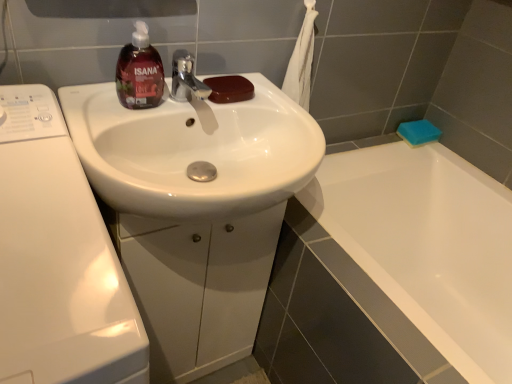
This screenshot has height=384, width=512. What do you see at coordinates (198, 287) in the screenshot? I see `white glossy cabinet at center` at bounding box center [198, 287].

What do you see at coordinates (418, 132) in the screenshot? The width and height of the screenshot is (512, 384). I see `blue sponge at upper right, which is the first soap from right to left` at bounding box center [418, 132].

In order to face brown glossy soap at center, which is the 2th soap in right-to-left order, should I rotate leftwards or rightwards?

It's best to rotate left around 3.288 degrees.

The height and width of the screenshot is (384, 512). Describe the element at coordinates (139, 72) in the screenshot. I see `translucent dark red liquid soap at upper left` at that location.

The image size is (512, 384). In order to click on white glossy washing machine at left in this screenshot , I will do `click(58, 259)`.

What are the coordinates of `white glossy cabinet at center` in the screenshot? It's located at (198, 287).

Is point (274, 243) positioned in front of point (233, 87)?

No, (274, 243) is further to viewer.

Is white glossy cabinet at center oriented towards brown glossy soap at center, the second soap from the back?

No, white glossy cabinet at center is not aimed at brown glossy soap at center, the second soap from the back.

Is white glossy cabinet at center thinner than brown glossy soap at center, placed as the first soap when sorted from left to right?

No.

Which soap is the 1st one when counting from the right side of the white glossy cabinet at center? Please provide its 2D coordinates.

[(229, 89)]

Looking at this image, can you confirm if brown glossy soap at center, placed as the first soap when sorted from left to right, is positioned to the right of blue sponge at upper right, the 2th soap viewed from the left?

Incorrect, brown glossy soap at center, placed as the first soap when sorted from left to right, is not on the right side of blue sponge at upper right, the 2th soap viewed from the left.

Does brown glossy soap at center, which is the 1th soap in front-to-back order, touch blue sponge at upper right, the 2th soap viewed from the left?

No, brown glossy soap at center, which is the 1th soap in front-to-back order, is not next to blue sponge at upper right, the 2th soap viewed from the left.

Does brown glossy soap at center, the second soap from the back, turn towards blue sponge at upper right, acting as the second soap starting from the front?

No, brown glossy soap at center, the second soap from the back, does not turn towards blue sponge at upper right, acting as the second soap starting from the front.

Is brown glossy soap at center, which is the 2th soap in right-to-left order, thinner than blue sponge at upper right, which is the first soap from right to left?

Yes.

Which of these two, translucent dark red liquid soap at upper left or white glossy washing machine at left, is thinner?

translucent dark red liquid soap at upper left is thinner.

Are translucent dark red liquid soap at upper left and white glossy washing machine at left located far from each other?

Actually, translucent dark red liquid soap at upper left and white glossy washing machine at left are a little close together.

Who is taller, translucent dark red liquid soap at upper left or white glossy washing machine at left?

white glossy washing machine at left is taller.

Is translucent dark red liquid soap at upper left behind white glossy washing machine at left?

Yes, it is behind white glossy washing machine at left.

How far apart are blue sponge at upper right, acting as the second soap starting from the front, and brown glossy soap at center, the second soap from the back?

blue sponge at upper right, acting as the second soap starting from the front, and brown glossy soap at center, the second soap from the back, are 30.25 inches apart from each other.

From a real-world perspective, relative to brown glossy soap at center, placed as the first soap when sorted from left to right, is blue sponge at upper right, which is the first soap from right to left, vertically above or below?

In terms of real-world spatial position, blue sponge at upper right, which is the first soap from right to left, is below brown glossy soap at center, placed as the first soap when sorted from left to right.

Considering the sizes of objects blue sponge at upper right, acting as the second soap starting from the front, and brown glossy soap at center, which is the 2th soap in right-to-left order, in the image provided, who is smaller, blue sponge at upper right, acting as the second soap starting from the front, or brown glossy soap at center, which is the 2th soap in right-to-left order,?

brown glossy soap at center, which is the 2th soap in right-to-left order.

Which object is thinner, blue sponge at upper right, acting as the second soap starting from the front, or brown glossy soap at center, placed as the first soap when sorted from left to right?

With smaller width is brown glossy soap at center, placed as the first soap when sorted from left to right.

In terms of height, does brown glossy soap at center, placed as the first soap when sorted from left to right, look taller or shorter compared to white glossy sink at center?

In the image, brown glossy soap at center, placed as the first soap when sorted from left to right, appears to be shorter than white glossy sink at center.

From a real-world perspective, is brown glossy soap at center, which is the 2th soap in right-to-left order, physically below white glossy sink at center?

Actually, brown glossy soap at center, which is the 2th soap in right-to-left order, is physically above white glossy sink at center in the real world.

Does brown glossy soap at center, placed as the first soap when sorted from left to right, touch white glossy sink at center?

They are not placed beside each other.

Considering the relative positions of brown glossy soap at center, placed as the first soap when sorted from left to right, and white glossy sink at center in the image provided, is brown glossy soap at center, placed as the first soap when sorted from left to right, to the left or to the right of white glossy sink at center?

Based on their positions, brown glossy soap at center, placed as the first soap when sorted from left to right, is located to the right of white glossy sink at center.

Do you think brown glossy soap at center, the second soap from the back, is within white glossy washing machine at left, or outside of it?

brown glossy soap at center, the second soap from the back, is not enclosed by white glossy washing machine at left.

Between brown glossy soap at center, which is the 2th soap in right-to-left order, and white glossy washing machine at left, which one has smaller width?

brown glossy soap at center, which is the 2th soap in right-to-left order, is thinner.

Can you tell me how much brown glossy soap at center, which is the 1th soap in front-to-back order, and white glossy washing machine at left differ in facing direction?

The angular difference between brown glossy soap at center, which is the 1th soap in front-to-back order, and white glossy washing machine at left is 1.34 degrees.

Is the depth of white glossy sink at center greater than that of translucent dark red liquid soap at upper left?

No, white glossy sink at center is in front of translucent dark red liquid soap at upper left.

Does point (65, 114) come farther from viewer compared to point (151, 51)?

No, it is not.

Who is bigger, white glossy sink at center or translucent dark red liquid soap at upper left?

white glossy sink at center.

Find the location of a particular element. This screenshot has width=512, height=384. the 1st soap behind the white glossy cabinet at center is located at coordinates (229, 89).

Identify the location of soap to the right of brown glossy soap at center, which is the 1th soap in front-to-back order. The image size is (512, 384). (418, 132).

Based on the photo, from the image, which object appears to be nearer to translucent dark red liquid soap at upper left, white glossy sink at center or white glossy cabinet at center?

white glossy sink at center.

Estimate the real-world distances between objects in this image. Which object is closer to translucent dark red liquid soap at upper left, blue sponge at upper right, acting as the second soap starting from the front, or white glossy washing machine at left?

The object closer to translucent dark red liquid soap at upper left is white glossy washing machine at left.

Looking at this image, considering their positions, is blue sponge at upper right, acting as the second soap starting from the front, positioned closer to white glossy washing machine at left than translucent dark red liquid soap at upper left?

translucent dark red liquid soap at upper left is positioned closer to the anchor white glossy washing machine at left.

Which object lies nearer to the anchor point translucent dark red liquid soap at upper left, white glossy cabinet at center or white glossy washing machine at left?

white glossy washing machine at left lies closer to translucent dark red liquid soap at upper left than the other object.

Based on their spatial positions, is brown glossy soap at center, placed as the first soap when sorted from left to right, or white glossy sink at center closer to white glossy cabinet at center?

white glossy sink at center lies closer to white glossy cabinet at center than the other object.

When comparing their distances from white glossy cabinet at center, does translucent dark red liquid soap at upper left or white glossy sink at center seem further?

translucent dark red liquid soap at upper left lies further to white glossy cabinet at center than the other object.

Looking at the image, which one is located further to blue sponge at upper right, acting as the second soap starting from the front, white glossy washing machine at left or translucent dark red liquid soap at upper left?

Among the two, white glossy washing machine at left is located further to blue sponge at upper right, acting as the second soap starting from the front.

Looking at the image, which one is located further to blue sponge at upper right, which is the first soap from right to left, white glossy sink at center or translucent dark red liquid soap at upper left?

translucent dark red liquid soap at upper left.

This screenshot has height=384, width=512. What are the coordinates of `soap between white glossy cabinet at center and blue sponge at upper right, acting as the second soap starting from the front` in the screenshot? It's located at (229, 89).

Image resolution: width=512 pixels, height=384 pixels. Find the location of `sink between translucent dark red liquid soap at upper left and white glossy washing machine at left from top to bottom`. sink between translucent dark red liquid soap at upper left and white glossy washing machine at left from top to bottom is located at coordinates (193, 151).

This screenshot has height=384, width=512. I want to click on mouthwash positioned between white glossy washing machine at left and blue sponge at upper right, acting as the second soap starting from the front, from near to far, so click(x=139, y=72).

Image resolution: width=512 pixels, height=384 pixels. Find the location of `drawer located between translucent dark red liquid soap at upper left and blue sponge at upper right, the 2th soap viewed from the left, in the left-right direction`. drawer located between translucent dark red liquid soap at upper left and blue sponge at upper right, the 2th soap viewed from the left, in the left-right direction is located at coordinates (198, 287).